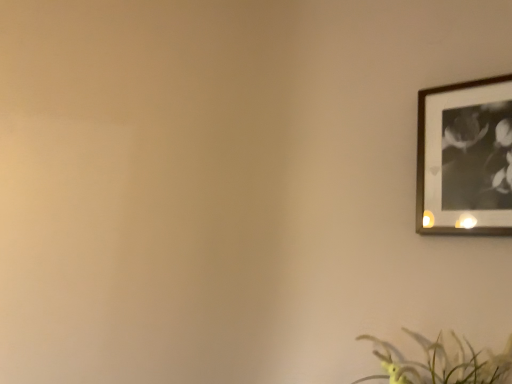
Identify the location of silver metallic picture frame at upper right. The image size is (512, 384). (465, 157).

This screenshot has height=384, width=512. What do you see at coordinates (465, 157) in the screenshot?
I see `silver metallic picture frame at upper right` at bounding box center [465, 157].

Identify the location of silver metallic picture frame at upper right. The image size is (512, 384). tap(465, 157).